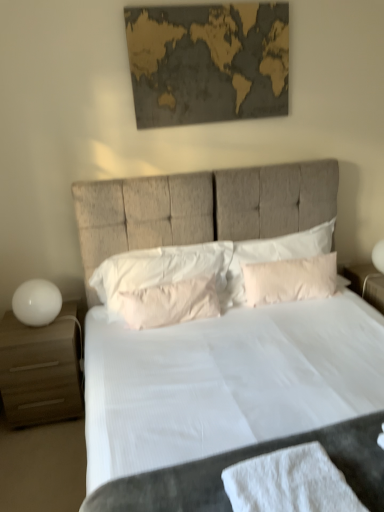
Locate an element on the screen. free point above gold textured map at upper center (from a real-world perspective) is located at coordinates (201, 0).